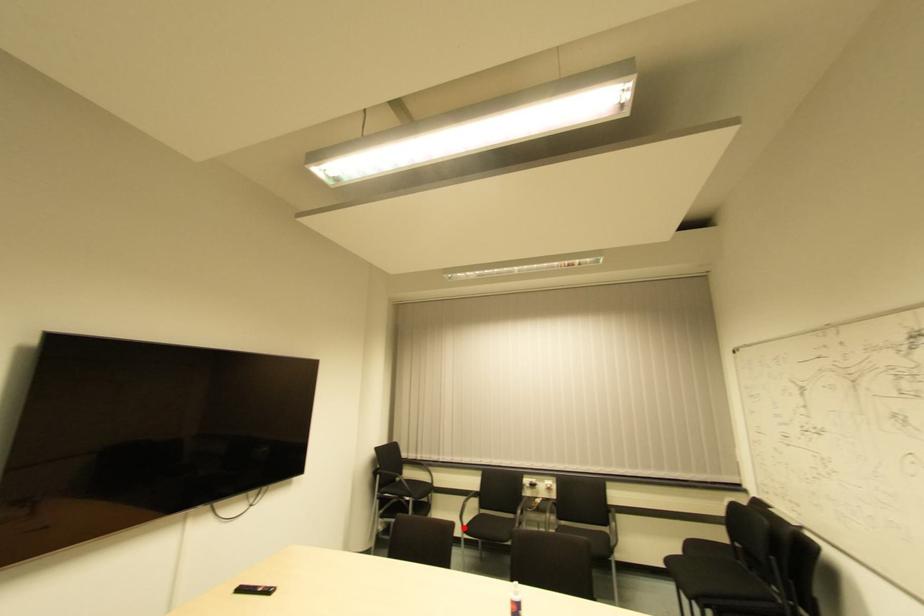
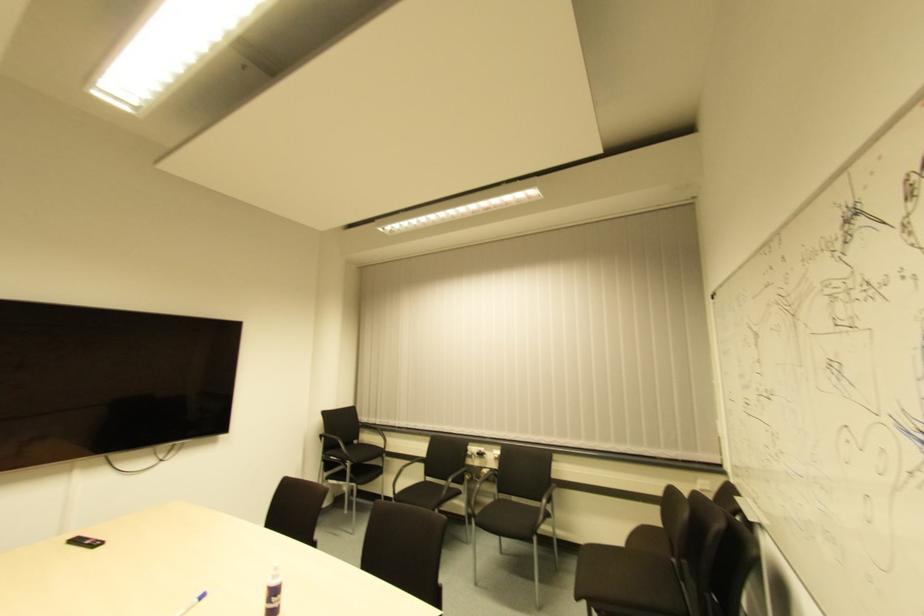
Locate, in the second image, the point that corresponds to the highlighted location in the first image.

(395, 495)